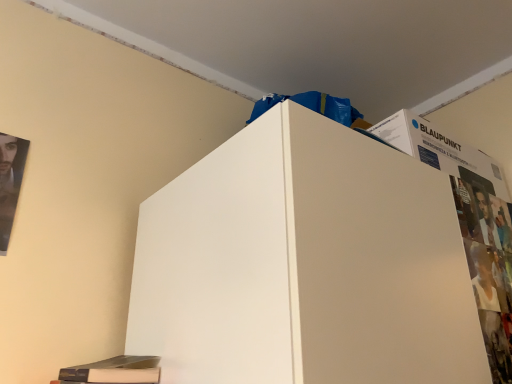
Image resolution: width=512 pixels, height=384 pixels. Describe the element at coordinates (10, 182) in the screenshot. I see `matte black poster at left` at that location.

The height and width of the screenshot is (384, 512). What are the coordinates of `matte black poster at left` in the screenshot? It's located at point(10,182).

Describe the element at coordinates (115, 371) in the screenshot. This screenshot has width=512, height=384. I see `matte black magazine at lower left` at that location.

The image size is (512, 384). What are the coordinates of `matte black magazine at lower left` in the screenshot? It's located at (115, 371).

This screenshot has height=384, width=512. Identify the location of matte black poster at left. (10, 182).

Does matte black magazine at lower left appear on the right side of matte black poster at left?

Correct, you'll find matte black magazine at lower left to the right of matte black poster at left.

Is matte black magazine at lower left further to camera compared to matte black poster at left?

No, matte black magazine at lower left is in front of matte black poster at left.

Which is behind, point (113, 357) or point (3, 141)?

The point (3, 141) is farther.

From the image's perspective, is matte black magazine at lower left located above matte black poster at left?

No, from the image's perspective, matte black magazine at lower left is not over matte black poster at left.

From the picture: From a real-world perspective, is matte black magazine at lower left above or below matte black poster at left?

From a real-world perspective, matte black magazine at lower left is physically below matte black poster at left.

Does matte black magazine at lower left have a greater width compared to matte black poster at left?

Yes, matte black magazine at lower left is wider than matte black poster at left.

From their relative heights in the image, would you say matte black magazine at lower left is taller or shorter than matte black poster at left?

Clearly, matte black magazine at lower left is shorter compared to matte black poster at left.

Who is smaller, matte black magazine at lower left or matte black poster at left?

matte black poster at left.

Would you say matte black magazine at lower left contains matte black poster at left?

No, matte black magazine at lower left does not contain matte black poster at left.

Is matte black magazine at lower left far away from matte black poster at left?

No, matte black magazine at lower left is not far from matte black poster at left.

Is matte black poster at left at the back of matte black magazine at lower left?

That's not correct — matte black magazine at lower left is not looking away from matte black poster at left.

How different are the orientations of matte black magazine at lower left and matte black poster at left in degrees?

The angular difference between matte black magazine at lower left and matte black poster at left is 0.545 degrees.

How far apart are matte black magazine at lower left and matte black poster at left?

The distance of matte black magazine at lower left from matte black poster at left is 16.04 inches.

This screenshot has width=512, height=384. In order to click on magazine on the right side of matte black poster at left in this screenshot , I will do `click(115, 371)`.

Which is more to the left, matte black poster at left or matte black magazine at lower left?

From the viewer's perspective, matte black poster at left appears more on the left side.

In the image, is matte black poster at left positioned in front of or behind matte black magazine at lower left?

In the image, matte black poster at left appears behind matte black magazine at lower left.

Is point (3, 172) closer to camera compared to point (100, 378)?

No.

From the image's perspective, between matte black poster at left and matte black magazine at lower left, who is located below?

matte black magazine at lower left is shown below in the image.

From a real-world perspective, between matte black poster at left and matte black magazine at lower left, who is vertically higher?

From a 3D spatial view, matte black poster at left is above.

In terms of width, does matte black poster at left look wider or thinner when compared to matte black magazine at lower left?

Clearly, matte black poster at left has less width compared to matte black magazine at lower left.

Who is taller, matte black poster at left or matte black magazine at lower left?

With more height is matte black poster at left.

Considering the relative sizes of matte black poster at left and matte black magazine at lower left in the image provided, is matte black poster at left smaller than matte black magazine at lower left?

Yes, matte black poster at left is smaller than matte black magazine at lower left.

Is matte black poster at left completely or partially outside of matte black magazine at lower left?

Indeed, matte black poster at left is completely outside matte black magazine at lower left.

Are matte black poster at left and matte black magazine at lower left beside each other?

There is a gap between matte black poster at left and matte black magazine at lower left.

Is matte black poster at left oriented away from matte black magazine at lower left?

matte black poster at left is not turned away from matte black magazine at lower left.

What's the angular difference between matte black poster at left and matte black magazine at lower left's facing directions?

The angular difference between matte black poster at left and matte black magazine at lower left is 0.545 degrees.

Locate an element on the screen. The height and width of the screenshot is (384, 512). poster page located above the matte black magazine at lower left (from the image's perspective) is located at coordinates (10, 182).

At what (x,y) coordinates should I click in order to perform the action: click on magazine directly beneath the matte black poster at left (from a real-world perspective). Please return your answer as a coordinate pair (x, y). Image resolution: width=512 pixels, height=384 pixels. Looking at the image, I should click on (115, 371).

The height and width of the screenshot is (384, 512). Find the location of `magazine that appears in front of the matte black poster at left`. magazine that appears in front of the matte black poster at left is located at coordinates (115, 371).